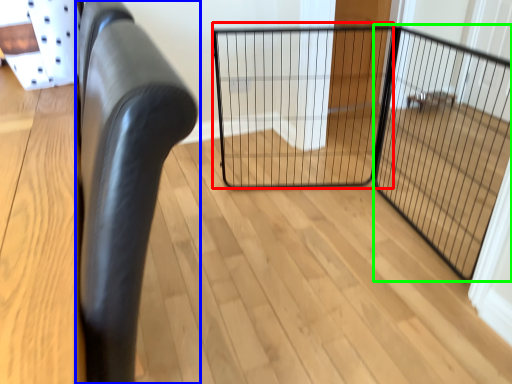
Question: Which object is positioned farthest from cage (highlighted by a red box)? Select from furniture (highlighted by a blue box) and screen door (highlighted by a green box).

Choices:
 (A) furniture
 (B) screen door

Answer: (A)